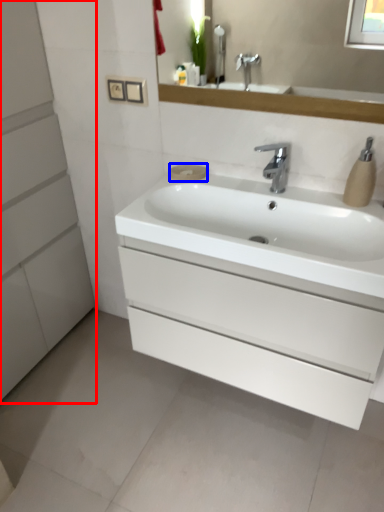
Question: Among these objects, which one is farthest to the camera, bathroom cabinet (highlighted by a red box) or soap (highlighted by a blue box)?

Choices:
 (A) bathroom cabinet
 (B) soap

Answer: (B)